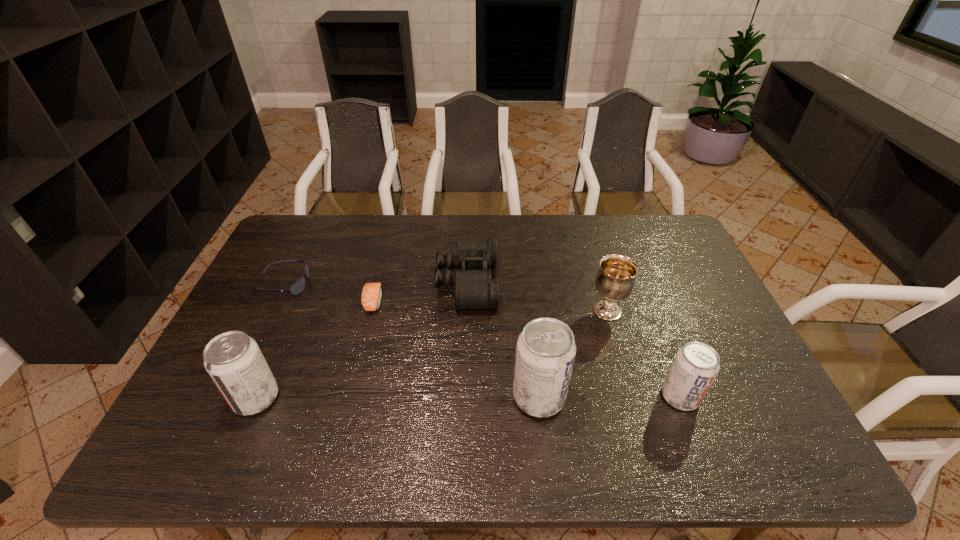
Identify the location of vacant space that satisfies the following two spatial constraints: 1. on the back side of the second shortest soda can; 2. on the left side of the third object from right to left. The width and height of the screenshot is (960, 540). (256, 396).